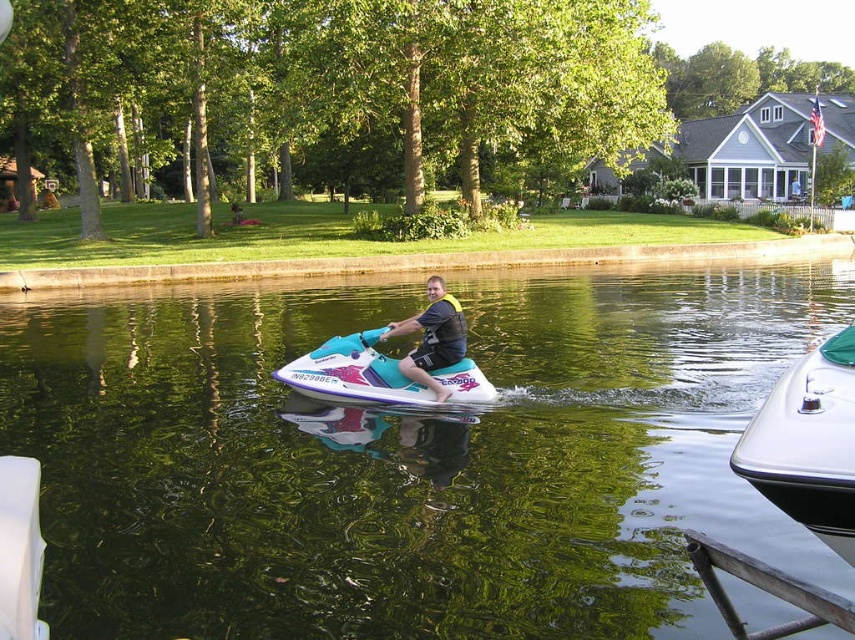
You are a photographer trying to capture a clear photo of the teal matte jet ski at center without the white glossy boat at lower right blocking it. Based on their positions, is this possible?

The white glossy boat at lower right is in front of the teal matte jet ski at center, so it would block the view. Move to a position where the boat is no longer between you and the jet ski.

You are standing on the dock and see both the white glossy boat at lower right and the teal matte jet ski at center. Which one is positioned to the right side of the other?

The white glossy boat at lower right is positioned to the right of the teal matte jet ski at center.

You are a photographer positioned at point (x=808, y=444). You want to capture a photo of the white glossy boat at lower right. Is the boat visible from your current position?

The boat is located at point (x=808, y=444), so yes, the boat is visible from your current position.